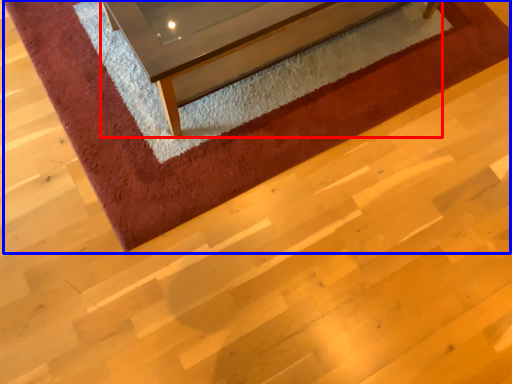
Question: Which object appears farthest to the camera in this image, furniture (highlighted by a red box) or mat (highlighted by a blue box)?

Choices:
 (A) furniture
 (B) mat

Answer: (B)